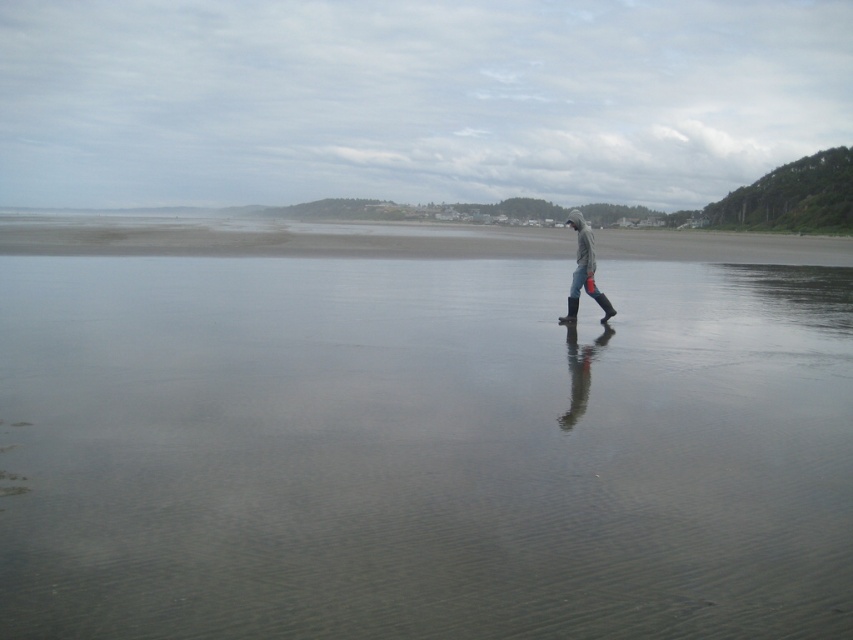
Question: Is smooth sand beach at center to the left of gray rubber boots at center from the viewer's perspective?

Choices:
 (A) yes
 (B) no

Answer: (A)

Question: Which object is farther from the camera taking this photo?

Choices:
 (A) smooth sand beach at center
 (B) gray rubber boots at center
 (C) clear water at center

Answer: (A)

Question: Does clear water at center have a lesser width compared to smooth sand beach at center?

Choices:
 (A) yes
 (B) no

Answer: (A)

Question: Does clear water at center appear over gray rubber boots at center?

Choices:
 (A) yes
 (B) no

Answer: (A)

Question: Among these points, which one is nearest to the camera?

Choices:
 (A) (155, 397)
 (B) (323, 236)

Answer: (A)

Question: Which point appears closest to the camera in this image?

Choices:
 (A) (589, 253)
 (B) (395, 225)

Answer: (A)